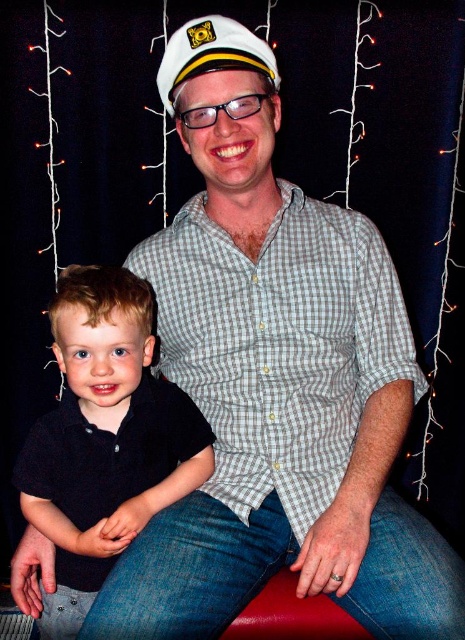
Question: Which object appears closest to the camera in this image?

Choices:
 (A) white matte sailor hat at upper center
 (B) black cotton shirt at lower left

Answer: (B)

Question: Does black cotton shirt at lower left appear on the right side of white matte sailor hat at upper center?

Choices:
 (A) yes
 (B) no

Answer: (B)

Question: Does black cotton shirt at lower left appear under white matte sailor hat at upper center?

Choices:
 (A) yes
 (B) no

Answer: (A)

Question: Can you confirm if black cotton shirt at lower left is thinner than white matte sailor hat at upper center?

Choices:
 (A) yes
 (B) no

Answer: (B)

Question: Which object appears farthest from the camera in this image?

Choices:
 (A) white matte sailor hat at upper center
 (B) black cotton shirt at lower left

Answer: (A)